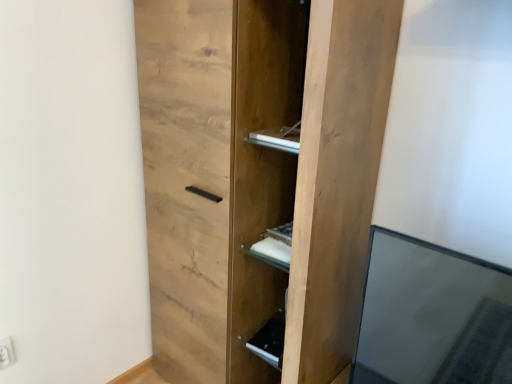
What do you see at coordinates (258, 176) in the screenshot? The height and width of the screenshot is (384, 512). I see `natural wood cupboard at center` at bounding box center [258, 176].

This screenshot has width=512, height=384. Find the location of `white plastic electric outlet at lower left`. white plastic electric outlet at lower left is located at coordinates pos(6,353).

Based on the photo, could you measure the distance between white plastic electric outlet at lower left and matte wood cabinet at lower center?

white plastic electric outlet at lower left and matte wood cabinet at lower center are 33.55 inches apart from each other.

Is matte wood cabinet at lower center completely or partially inside white plastic electric outlet at lower left?

That's incorrect, matte wood cabinet at lower center is not inside white plastic electric outlet at lower left.

Is white plastic electric outlet at lower left facing away from matte wood cabinet at lower center?

No, white plastic electric outlet at lower left's orientation is not away from matte wood cabinet at lower center.

In the scene shown: Between white plastic electric outlet at lower left and matte wood cabinet at lower center, which one has less height?

matte wood cabinet at lower center.

Between white plastic electric outlet at lower left and natural wood cupboard at center, which one has larger width?

Wider between the two is natural wood cupboard at center.

Is white plastic electric outlet at lower left not close to natural wood cupboard at center?

A: They are positioned close to each other.

Is white plastic electric outlet at lower left to the left or to the right of natural wood cupboard at center in the image?

Based on their positions, white plastic electric outlet at lower left is located to the left of natural wood cupboard at center.

Looking at this image, is matte wood cabinet at lower center oriented away from natural wood cupboard at center?

Yes, matte wood cabinet at lower center's orientation is away from natural wood cupboard at center.

Do you think matte wood cabinet at lower center is within natural wood cupboard at center, or outside of it?

matte wood cabinet at lower center is located inside natural wood cupboard at center.

From a real-world perspective, which is physically below, matte wood cabinet at lower center or natural wood cupboard at center?

From a 3D spatial view, matte wood cabinet at lower center is below.

Is matte wood cabinet at lower center next to natural wood cupboard at center?

They are not placed beside each other.

How many degrees apart are the facing directions of matte wood cabinet at lower center and white plastic electric outlet at lower left?

82.7 degrees.

Do you think matte wood cabinet at lower center is within white plastic electric outlet at lower left, or outside of it?

matte wood cabinet at lower center exists outside the volume of white plastic electric outlet at lower left.

From the image's perspective, is matte wood cabinet at lower center located beneath white plastic electric outlet at lower left?

Actually, matte wood cabinet at lower center appears above white plastic electric outlet at lower left in the image.

Is matte wood cabinet at lower center aimed at white plastic electric outlet at lower left?

No, matte wood cabinet at lower center is not facing towards white plastic electric outlet at lower left.

From a real-world perspective, relative to matte wood cabinet at lower center, is natural wood cupboard at center vertically above or below?

Clearly, from a real-world perspective, natural wood cupboard at center is above matte wood cabinet at lower center.

Does natural wood cupboard at center turn towards matte wood cabinet at lower center?

Yes, natural wood cupboard at center is oriented towards matte wood cabinet at lower center.

Based on the photo, are natural wood cupboard at center and matte wood cabinet at lower center beside each other?

No, natural wood cupboard at center is not with matte wood cabinet at lower center.

This screenshot has width=512, height=384. There is a matte wood cabinet at lower center. What are the coordinates of `cupboard above it (from a real-world perspective)` in the screenshot? It's located at coord(258,176).

Is natural wood cupboard at center to the right of white plastic electric outlet at lower left from the viewer's perspective?

Correct, you'll find natural wood cupboard at center to the right of white plastic electric outlet at lower left.

There is a white plastic electric outlet at lower left. At what (x,y) coordinates should I click in order to perform the action: click on cupboard above it (from a real-world perspective). Please return your answer as a coordinate pair (x, y). This screenshot has height=384, width=512. Looking at the image, I should click on (258, 176).

Can you confirm if natural wood cupboard at center is shorter than white plastic electric outlet at lower left?

No.

Is white plastic electric outlet at lower left completely or partially inside natural wood cupboard at center?

No, white plastic electric outlet at lower left is not inside natural wood cupboard at center.

Locate an element on the screen. The width and height of the screenshot is (512, 384). electric outlet that appears on the left of matte wood cabinet at lower center is located at coordinates (6, 353).

Find the location of a particular element. This screenshot has height=384, width=512. cupboard that appears above the white plastic electric outlet at lower left (from the image's perspective) is located at coordinates (258, 176).

Looking at the image, which one is located further to natural wood cupboard at center, white plastic electric outlet at lower left or matte wood cabinet at lower center?

The object further to natural wood cupboard at center is white plastic electric outlet at lower left.

Looking at this image, looking at the image, which one is located closer to matte wood cabinet at lower center, white plastic electric outlet at lower left or natural wood cupboard at center?

natural wood cupboard at center.

Looking at the image, which one is located further to white plastic electric outlet at lower left, natural wood cupboard at center or matte wood cabinet at lower center?

Based on the image, natural wood cupboard at center appears to be further to white plastic electric outlet at lower left.

Which object lies further to the anchor point white plastic electric outlet at lower left, matte wood cabinet at lower center or natural wood cupboard at center?

natural wood cupboard at center.

When comparing their distances from natural wood cupboard at center, does matte wood cabinet at lower center or white plastic electric outlet at lower left seem further?

Based on the image, white plastic electric outlet at lower left appears to be further to natural wood cupboard at center.

Based on their spatial positions, is natural wood cupboard at center or white plastic electric outlet at lower left closer to matte wood cabinet at lower center?

natural wood cupboard at center lies closer to matte wood cabinet at lower center than the other object.

At what (x,y) coordinates should I click in order to perform the action: click on cupboard between white plastic electric outlet at lower left and matte wood cabinet at lower center in the horizontal direction. Please return your answer as a coordinate pair (x, y). Looking at the image, I should click on (258, 176).